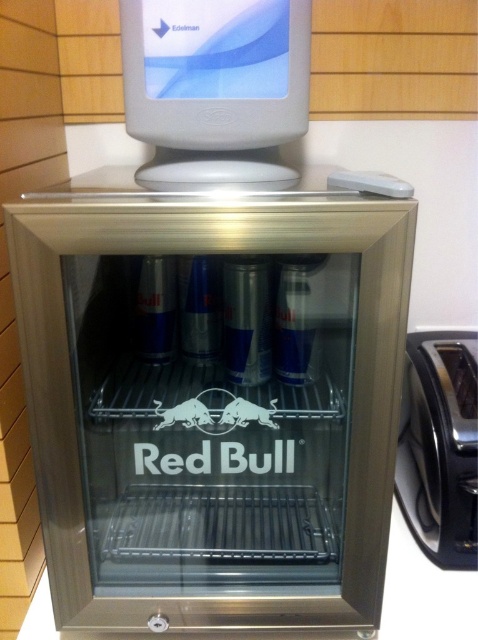
Measure the distance between point [291,42] and camera.

Point [291,42] is 26.81 inches from camera.

Between white plastic monitor at upper center and satin chrome toaster at lower right, which one appears on the right side from the viewer's perspective?

From the viewer's perspective, satin chrome toaster at lower right appears more on the right side.

Who is more distant from viewer, (254, 12) or (412, 416)?

Positioned behind is point (412, 416).

Where is `white plastic monitor at upper center`? The height and width of the screenshot is (640, 478). white plastic monitor at upper center is located at coordinates (215, 88).

Is point (259, 470) closer to camera compared to point (261, 141)?

That is False.

Is the position of satin silver fridge at center more distant than that of white plastic monitor at upper center?

No, it is not.

You are a GUI agent. You are given a task and a screenshot of the screen. Output one action in this format:
    pyautogui.click(x=<x>, y=<y>)
    Task: Click on the satin silver fridge at center
    
    Given the screenshot: What is the action you would take?
    pos(214,397)

Who is higher up, satin silver fridge at center or satin chrome toaster at lower right?

satin silver fridge at center is above.

Is satin silver fridge at center smaller than satin chrome toaster at lower right?

Actually, satin silver fridge at center might be larger than satin chrome toaster at lower right.

Which is in front, point (44, 524) or point (416, 538)?

Point (44, 524)

Locate an element on the screen. The image size is (478, 640). satin silver fridge at center is located at coordinates (214, 397).